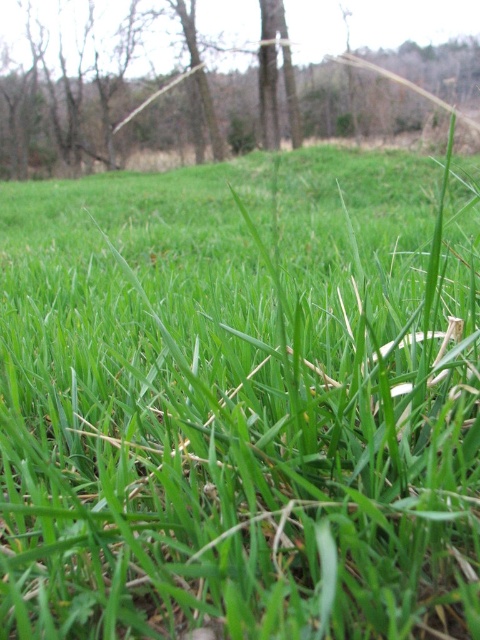
Question: Which of the following is the farthest from the observer?

Choices:
 (A) smooth brown tree trunk at center
 (B) brown wood tree at center

Answer: (B)

Question: In this image, where is brown wood tree at center located relative to smooth brown tree trunk at center?

Choices:
 (A) above
 (B) below

Answer: (A)

Question: Is brown wood tree at center to the left of smooth brown tree trunk at center from the viewer's perspective?

Choices:
 (A) yes
 (B) no

Answer: (B)

Question: Which point is farther to the camera?

Choices:
 (A) (264, 77)
 (B) (415, 28)

Answer: (B)

Question: Does brown wood tree at center appear under smooth brown tree trunk at center?

Choices:
 (A) no
 (B) yes

Answer: (A)

Question: Which point is closer to the camera taking this photo?

Choices:
 (A) (9, 44)
 (B) (278, 16)

Answer: (A)